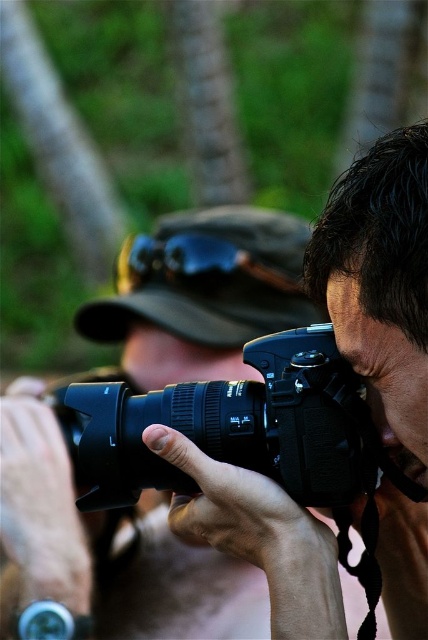
You are a photographer who wants to place a sticker on the exact center of the black matte camera at center. According to the coordinates provided, is the point at (107, 547) on the camera?

Yes, the point at (107, 547) is on the black matte camera at center according to the coordinates provided.

You are a photographer trying to organize your equipment. You have two cameras in front of you, the black matte camera at center and the black plastic camera at center. Which one is positioned to the left?

The black matte camera at center is to the left of the black plastic camera at center.